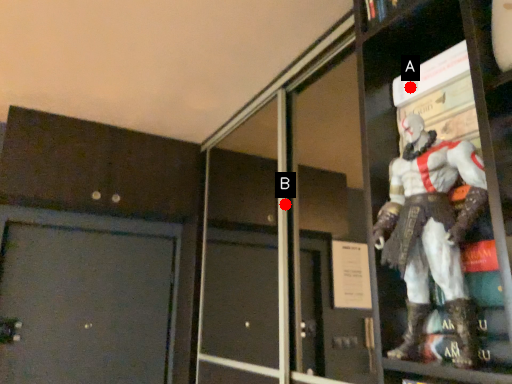
Question: Two points are circled on the image, labeled by A and B beside each circle. Which point is closer to the camera?

Choices:
 (A) A is closer
 (B) B is closer

Answer: (A)